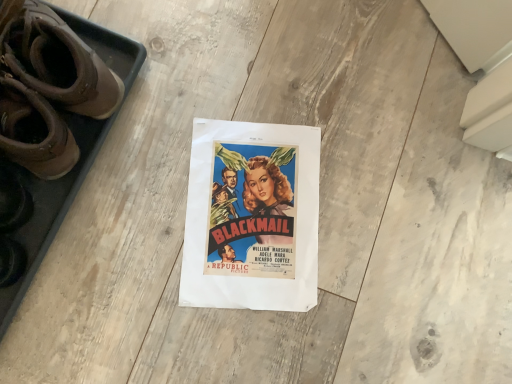
What are the coordinates of `matte paper poster at center` in the screenshot? It's located at (252, 217).

The image size is (512, 384). Describe the element at coordinates (252, 217) in the screenshot. I see `matte paper poster at center` at that location.

Measure the distance between matte paper poster at center and camera.

The distance of matte paper poster at center from camera is 25.11 inches.

Measure the distance between point (73, 45) and camera.

22.64 inches.

The image size is (512, 384). I want to click on brown leather boots at left, so click(48, 85).

This screenshot has height=384, width=512. Describe the element at coordinates (48, 85) in the screenshot. I see `brown leather boots at left` at that location.

Locate an element on the screen. The height and width of the screenshot is (384, 512). matte paper poster at center is located at coordinates (252, 217).

From the picture: Between brown leather boots at left and matte paper poster at center, which one appears on the left side from the viewer's perspective?

Positioned to the left is brown leather boots at left.

Based on the photo, considering the relative positions of brown leather boots at left and matte paper poster at center in the image provided, is brown leather boots at left behind matte paper poster at center?

No.

Which is further, (4, 142) or (243, 137)?

The point (243, 137) is farther.

From the image's perspective, is brown leather boots at left under matte paper poster at center?

No, from the image's perspective, brown leather boots at left is not below matte paper poster at center.

From a real-world perspective, who is located lower, brown leather boots at left or matte paper poster at center?

matte paper poster at center, from a real-world perspective.

Does brown leather boots at left have a greater width compared to matte paper poster at center?

Incorrect, the width of brown leather boots at left does not surpass that of matte paper poster at center.

Can you confirm if brown leather boots at left is shorter than matte paper poster at center?

No.

Considering the sizes of objects brown leather boots at left and matte paper poster at center in the image provided, who is smaller, brown leather boots at left or matte paper poster at center?

matte paper poster at center is smaller.

Is matte paper poster at center a part of brown leather boots at left?

Actually, matte paper poster at center is outside brown leather boots at left.

Is brown leather boots at left touching matte paper poster at center?

brown leather boots at left and matte paper poster at center are not in contact.

In the scene shown: Is brown leather boots at left aimed at matte paper poster at center?

No, brown leather boots at left does not turn towards matte paper poster at center.

How different are the orientations of brown leather boots at left and matte paper poster at center in degrees?

The facing directions of brown leather boots at left and matte paper poster at center are 125 degrees apart.

Locate an element on the screen. Image resolution: width=512 pixels, height=384 pixels. poster located on the right of brown leather boots at left is located at coordinates (x=252, y=217).

Considering the positions of objects matte paper poster at center and brown leather boots at left in the image provided, who is more to the right, matte paper poster at center or brown leather boots at left?

Positioned to the right is matte paper poster at center.

Considering the relative positions of matte paper poster at center and brown leather boots at left in the image provided, is matte paper poster at center behind brown leather boots at left?

Yes, it is.

Which point is more distant from viewer, (209, 123) or (3, 2)?

Positioned behind is point (209, 123).

From the image's perspective, is matte paper poster at center under brown leather boots at left?

Yes, from the image's perspective, matte paper poster at center is beneath brown leather boots at left.

From a real-world perspective, which object rests below the other?

In real-world perspective, matte paper poster at center is lower.

Which of these two, matte paper poster at center or brown leather boots at left, is thinner?

brown leather boots at left is thinner.

In terms of height, does matte paper poster at center look taller or shorter compared to brown leather boots at left?

Considering their sizes, matte paper poster at center has less height than brown leather boots at left.

Which of these two, matte paper poster at center or brown leather boots at left, is smaller?

Smaller between the two is matte paper poster at center.

Is matte paper poster at center positioned beyond the bounds of brown leather boots at left?

matte paper poster at center lies outside brown leather boots at left's area.

Is matte paper poster at center next to brown leather boots at left?

No, matte paper poster at center is not beside brown leather boots at left.

Could you tell me if matte paper poster at center is turned towards brown leather boots at left?

No, matte paper poster at center is not turned towards brown leather boots at left.

How many degrees apart are the facing directions of matte paper poster at center and brown leather boots at left?

125 degrees.

Find the location of `footwear in front of the matte paper poster at center`. footwear in front of the matte paper poster at center is located at coordinates (48, 85).

Where is `poster that is under the brown leather boots at left (from a real-world perspective)`? poster that is under the brown leather boots at left (from a real-world perspective) is located at coordinates click(252, 217).

Where is `poster on the right of the brown leather boots at left`? This screenshot has height=384, width=512. poster on the right of the brown leather boots at left is located at coordinates (252, 217).